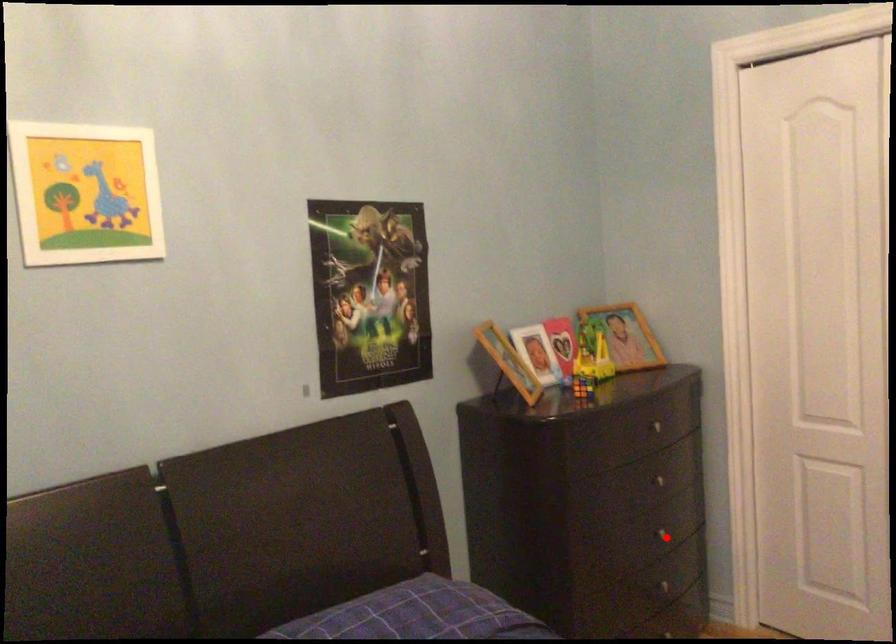
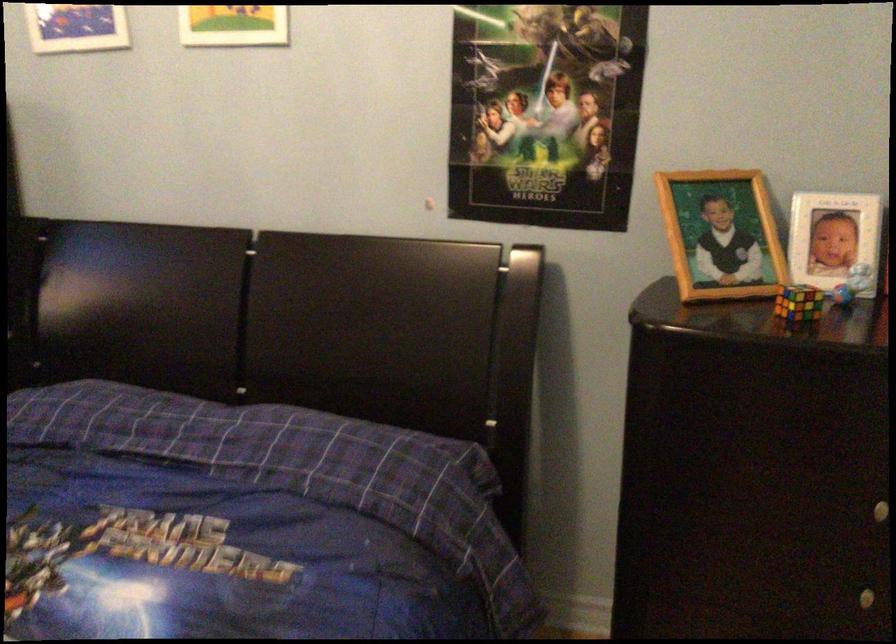
Question: I am providing you with two images of the same scene from different viewpoints. A red point is marked on the first image. Can you still see the location of the red point in image 2?

Choices:
 (A) Yes
 (B) No

Answer: (A)